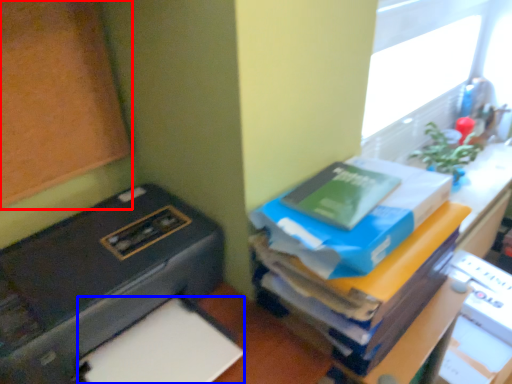
Question: Which object is closer to the camera taking this photo, bulletin board (highlighted by a red box) or paper (highlighted by a blue box)?

Choices:
 (A) bulletin board
 (B) paper

Answer: (A)